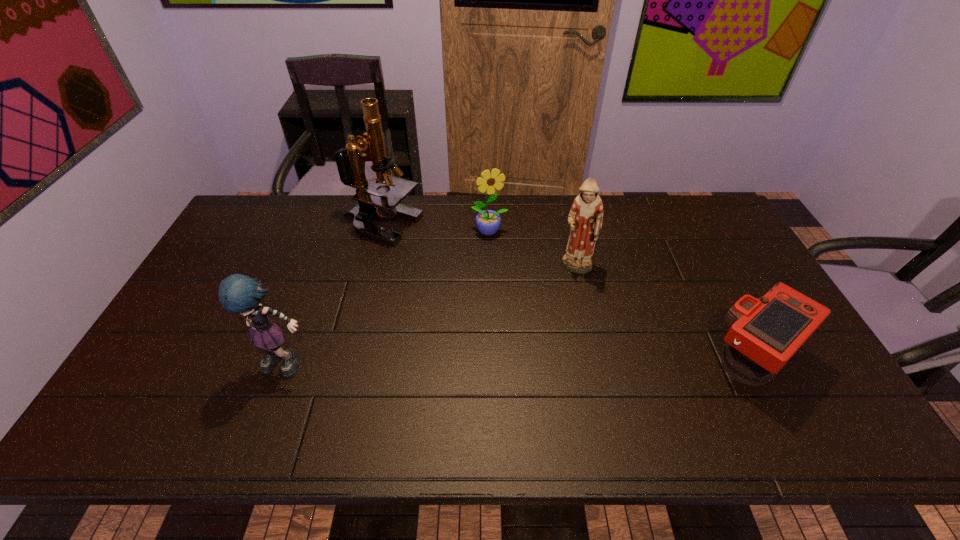
Locate an element on the screen. The width and height of the screenshot is (960, 540). vacant spot on the desktop that is between the rag doll and the rightmost object and is positioned at the eyepiece of the tallest object is located at coordinates (535, 362).

The image size is (960, 540). Identify the location of free space on the desktop that is between the rag doll and the rightmost object and is positioned on the front-facing side of the second object from right to left. (578, 362).

Locate an element on the screen. This screenshot has height=540, width=960. vacant space on the desktop that is between the rag doll and the camera and is positioned on the front-facing side of the second shortest object is located at coordinates (539, 362).